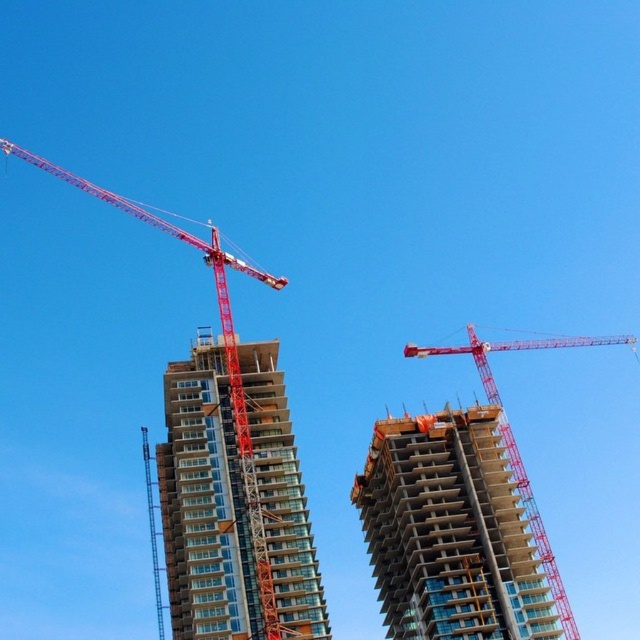
Based on the photo, you are a construction worker who needs to move a heavy beam from the red metal crane at upper left to the glassy concrete building at center. Which direction should you move the beam to ensure it reaches the correct building?

You should move the beam to the right, as the glassy concrete building at center is located to the right of the red metal crane at upper left.

Consider the image. You are a construction worker standing at the base of the red metal crane at upper left and need to move to the concrete building at center. Which direction should you walk to reach it?

The concrete building at center is positioned on the right side of the red metal crane at upper left, so you should walk to your right to reach it.